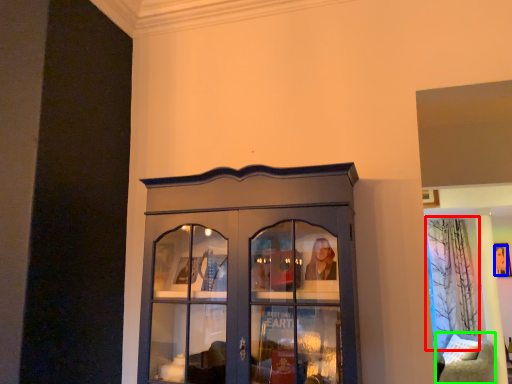
Question: Which is farther away from curtain (highlighted by a red box)? person (highlighted by a blue box) or furniture (highlighted by a green box)?

Choices:
 (A) person
 (B) furniture

Answer: (B)